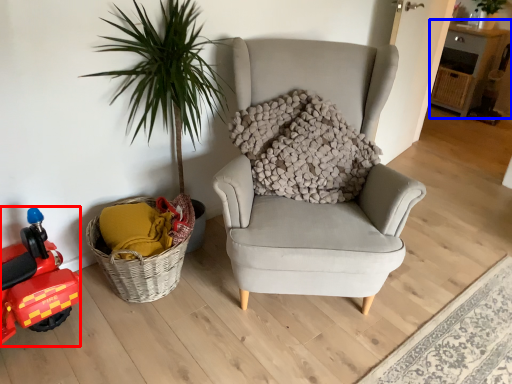
Question: Which object appears farthest to the camera in this image, toy car (highlighted by a red box) or table (highlighted by a blue box)?

Choices:
 (A) toy car
 (B) table

Answer: (B)